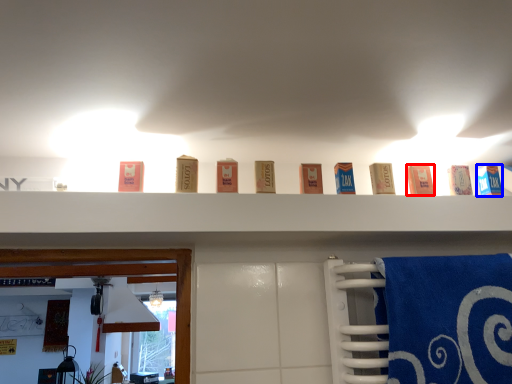
Question: Which object appears closest to the camera in this image, product (highlighted by a red box) or product (highlighted by a blue box)?

Choices:
 (A) product
 (B) product

Answer: (A)